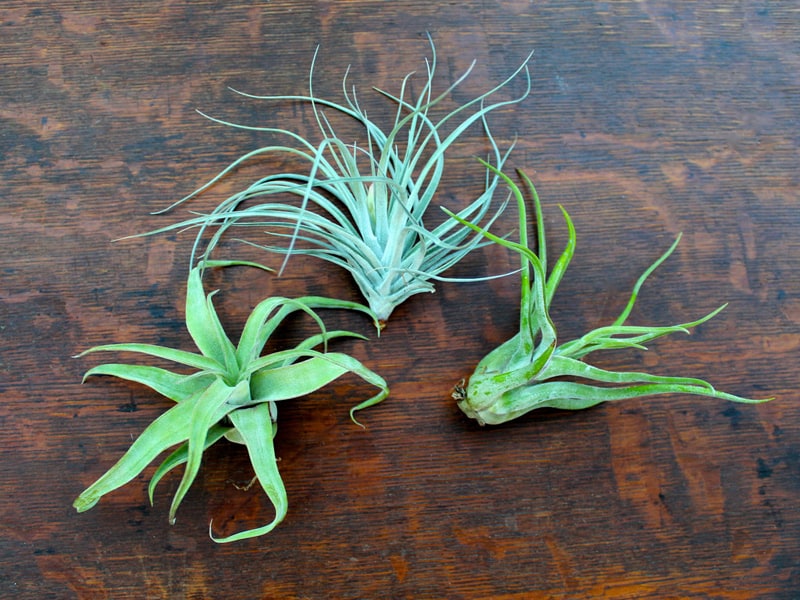
In order to click on air plants in this screenshot , I will do `click(401, 234)`, `click(238, 394)`, `click(484, 396)`.